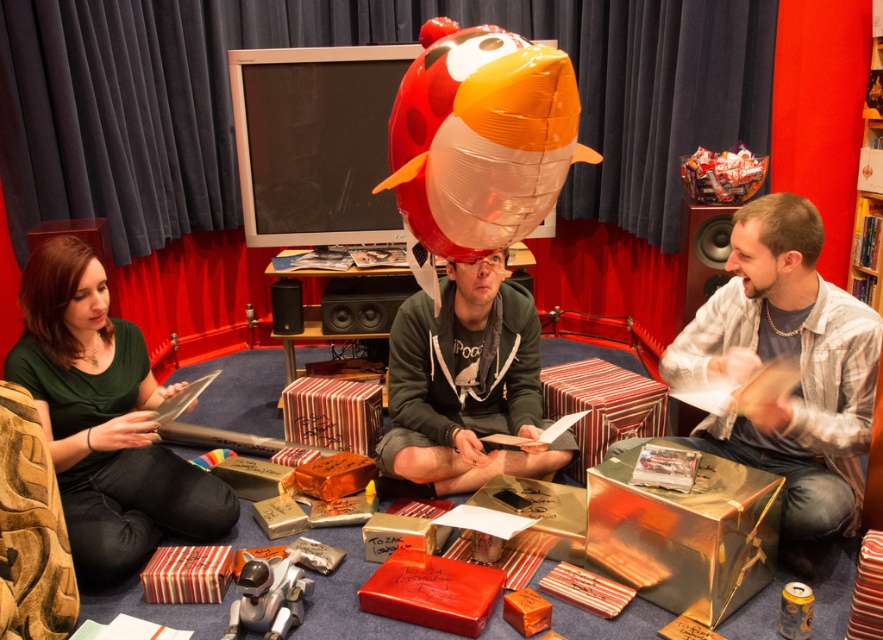
Which is behind, point (102, 420) or point (432, 28)?

The point (102, 420) is more distant.

Is point (238, 515) farther from viewer compared to point (519, 182)?

Yes, it is.

Who is more distant from viewer, (195, 516) or (492, 227)?

Point (195, 516)

At what (x,y) coordinates should I click in order to perform the action: click on green matte shirt at left. Please return your answer as a coordinate pair (x, y). Image resolution: width=883 pixels, height=640 pixels. Looking at the image, I should click on (104, 419).

Which of these two, green matte shirt at left or matte black speaker at right, stands shorter?

matte black speaker at right is shorter.

Which is behind, point (38, 396) or point (702, 259)?

Point (702, 259)

The width and height of the screenshot is (883, 640). I want to click on green matte shirt at left, so click(x=104, y=419).

Does matte black speaker at right appear on the left side of black matte speaker at center?

Incorrect, matte black speaker at right is not on the left side of black matte speaker at center.

Does point (685, 241) come behind point (331, 298)?

No, (685, 241) is closer to viewer.

Locate an element on the screen. matte black speaker at right is located at coordinates (703, 250).